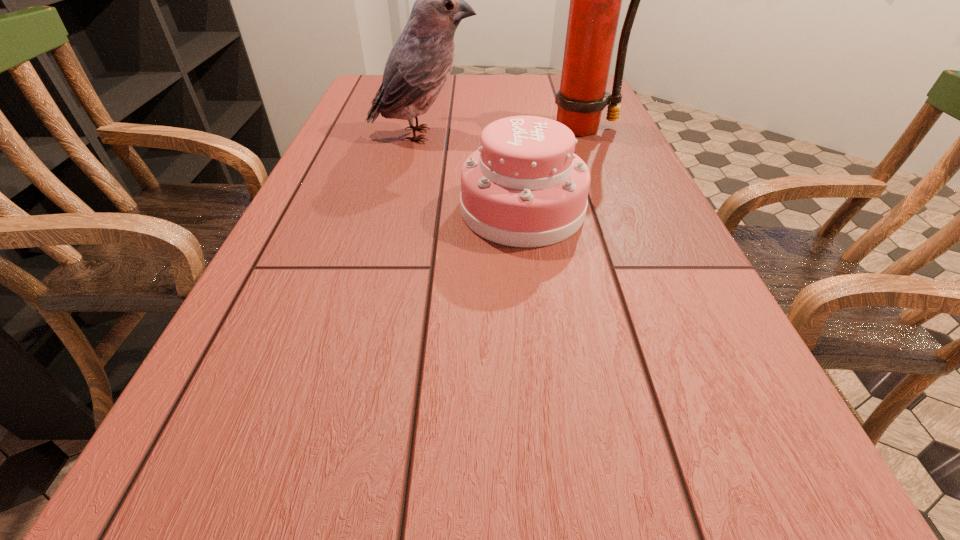
Locate an element on the screen. The image size is (960, 540). fire extinguisher is located at coordinates (595, 0).

Find the location of a particular element. The height and width of the screenshot is (540, 960). parrot is located at coordinates (419, 64).

Identify the location of birthday cake. (524, 187).

In order to click on the shortest object in this screenshot , I will do `click(524, 187)`.

Locate an element on the screen. The height and width of the screenshot is (540, 960). vacant area located at the nozzle of the tallest object is located at coordinates click(x=594, y=152).

You are a GUI agent. You are given a task and a screenshot of the screen. Output one action in this format:
    pyautogui.click(x=<x>, y=<y>)
    Task: Click on the vacant region located 0.260m on the front-facing side of the parrot
    Image resolution: width=960 pixels, height=540 pixels.
    Given the screenshot: What is the action you would take?
    pyautogui.click(x=578, y=134)

Image resolution: width=960 pixels, height=540 pixels. I want to click on vacant space located 0.310m on the back of the nearest object, so click(x=512, y=119).

Locate an element on the screen. This screenshot has height=540, width=960. object that is positioned at the left edge is located at coordinates (419, 64).

This screenshot has height=540, width=960. I want to click on object positioned at the right edge, so click(595, 0).

This screenshot has height=540, width=960. I want to click on free location at the far edge of the desktop, so click(x=471, y=87).